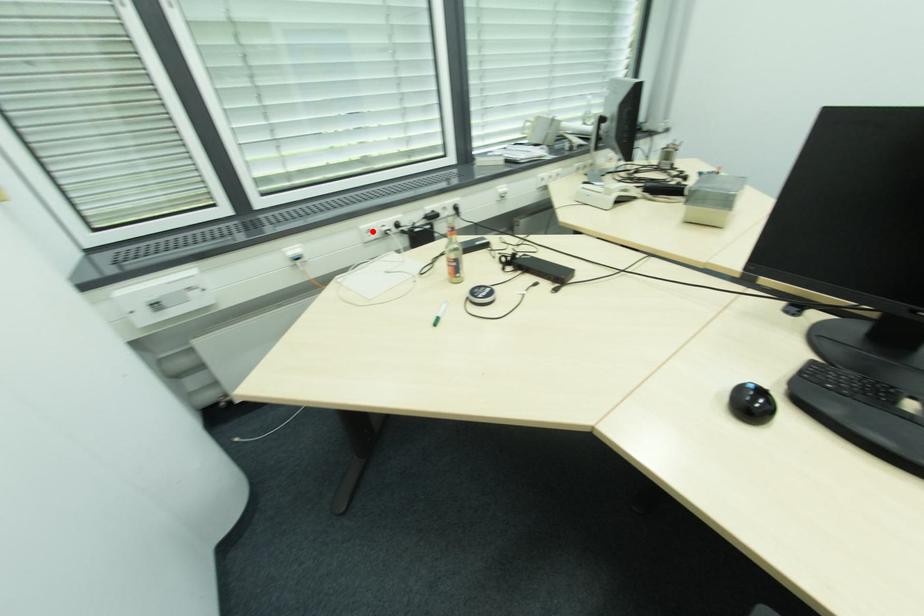
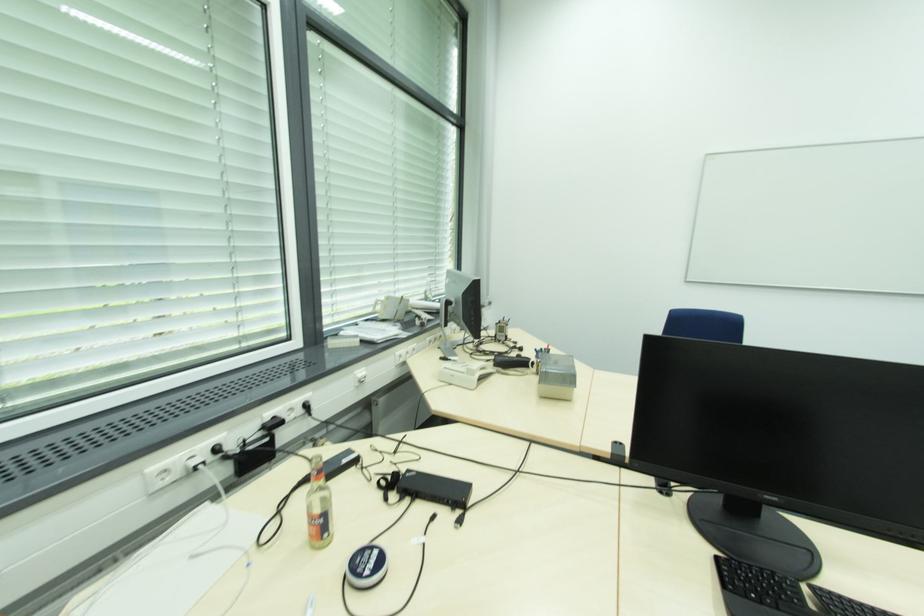
The point at the highlighted location is marked in the first image. Where is the corresponding point in the second image?

(167, 472)